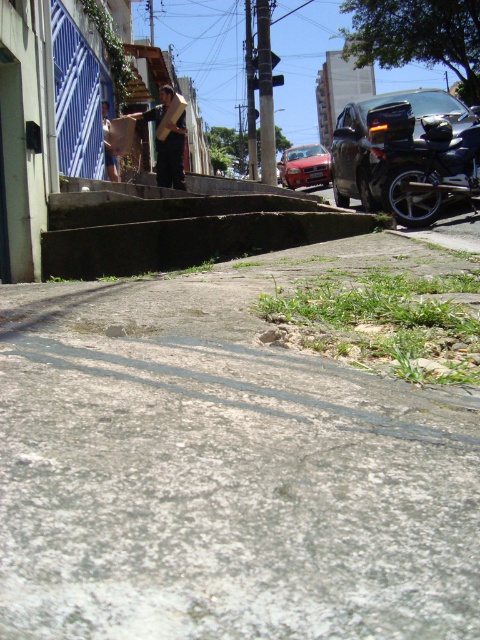
You are standing on the gray concrete pavement at lower center and want to reach the brown concrete stairs at center. Which direction should you move to get there?

The gray concrete pavement at lower center is to the right of the brown concrete stairs at center, so you should move to the left to reach them.